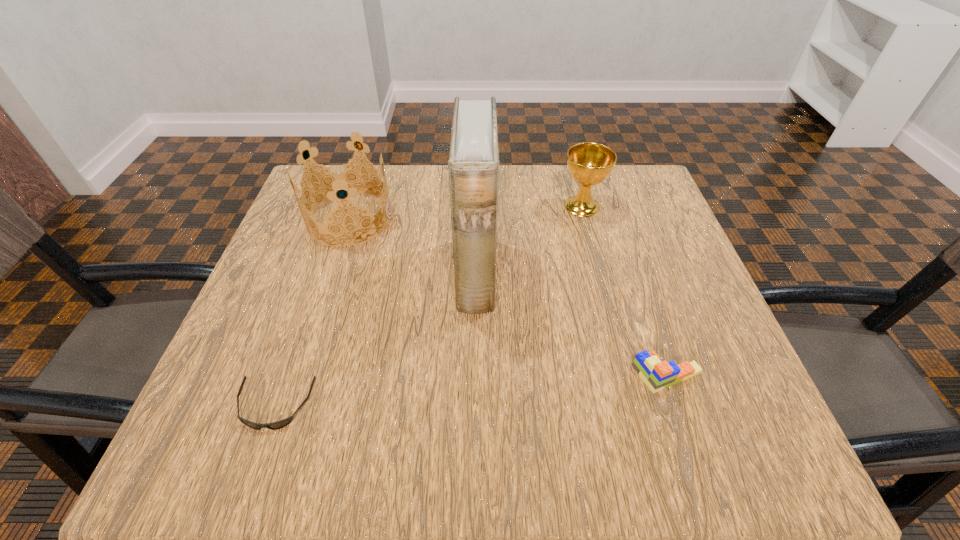
Locate an element on the screen. The image size is (960, 540). free space between the fourth tallest object and the crown is located at coordinates (509, 297).

I want to click on vacant point located between the Lego and the second tallest object, so click(x=509, y=297).

Locate which object is the closest to the fourth tallest object. Please provide its 2D coordinates. Your answer should be formatted as a tuple, i.e. [(x, y)], where the tuple contains the x and y coordinates of a point satisfying the conditions above.

[(473, 165)]

You are a GUI agent. You are given a task and a screenshot of the screen. Output one action in this format:
    pyautogui.click(x=<x>, y=<y>)
    Task: Click on the object that is the second closest to the chalice
    The height and width of the screenshot is (540, 960).
    Given the screenshot: What is the action you would take?
    pyautogui.click(x=657, y=375)

Locate an element on the screen. Image resolution: width=960 pixels, height=540 pixels. free point that satisfies the following two spatial constraints: 1. on the front side of the third shortest object; 2. on the cover of the third object from left to right is located at coordinates click(600, 275).

This screenshot has width=960, height=540. Find the location of `free spot that satisfies the following two spatial constraints: 1. on the cover of the tallest object; 2. on the front-facing side of the shortest object`. free spot that satisfies the following two spatial constraints: 1. on the cover of the tallest object; 2. on the front-facing side of the shortest object is located at coordinates (474, 406).